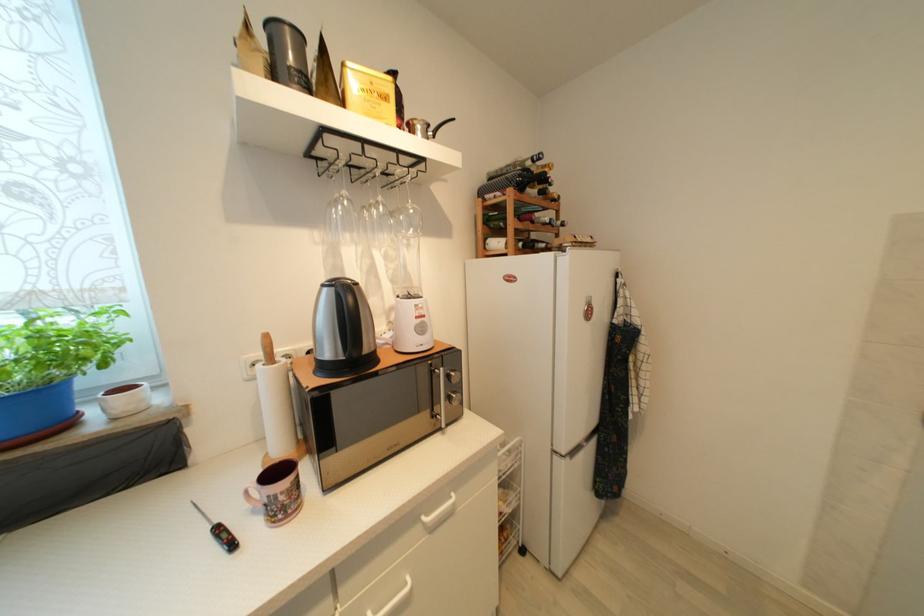
This screenshot has height=616, width=924. What do you see at coordinates (438, 128) in the screenshot?
I see `the saucepan handle` at bounding box center [438, 128].